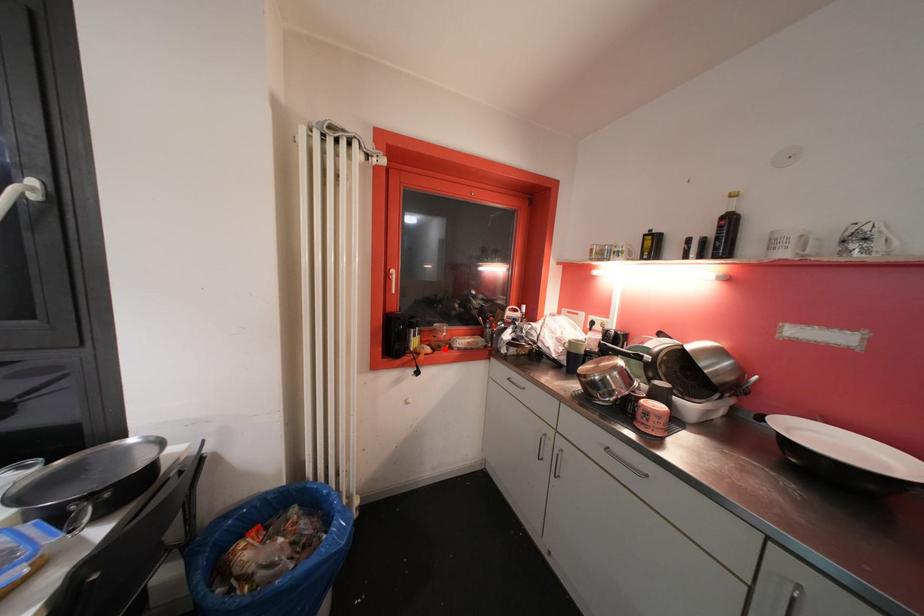
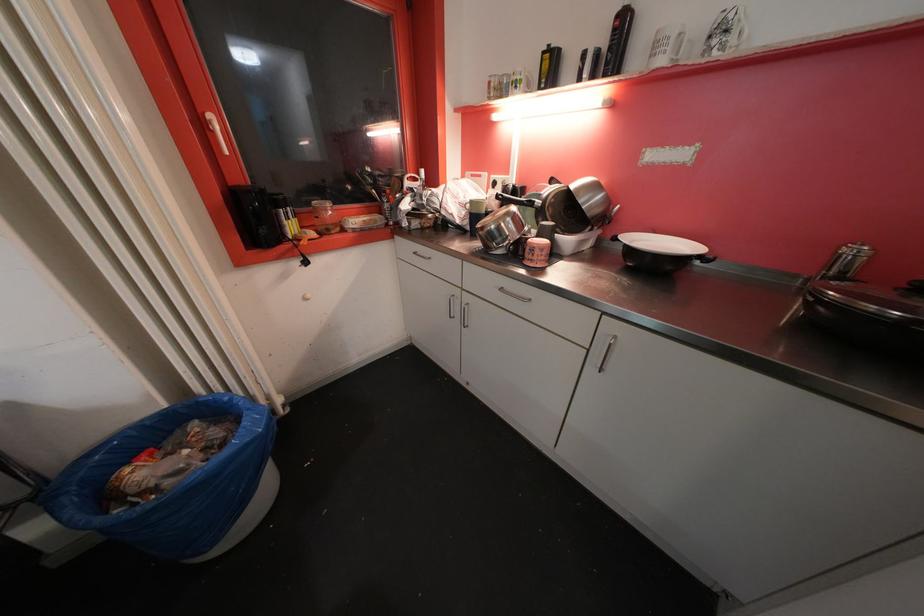
Question: I am providing you with two images of the same scene from different viewpoints. Image1 has a red point marked. In image2, the corresponding 3D location appears at what relative position? Reply with the corresponding letter.

Choices:
 (A) Closer
 (B) Farther

Answer: (A)